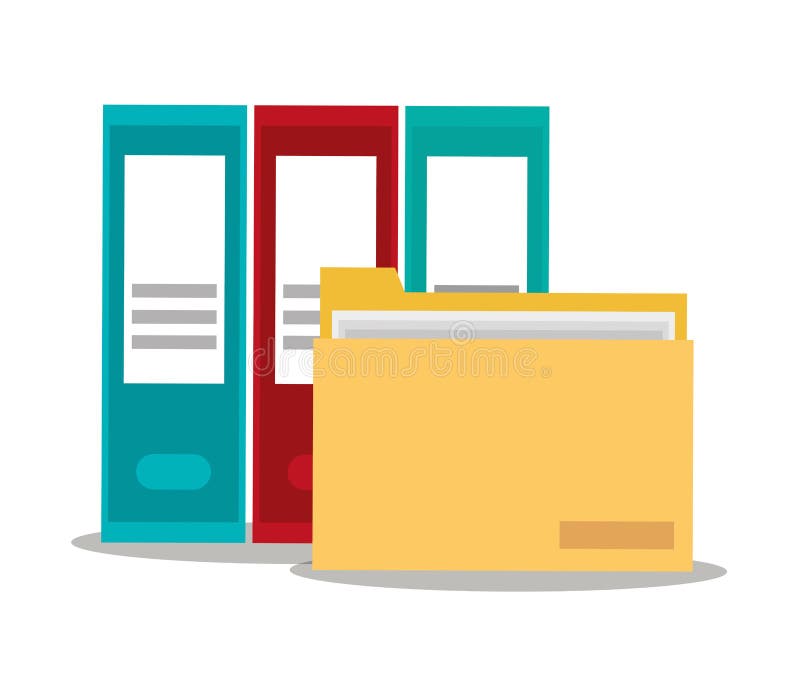
The image size is (800, 697). I want to click on white label on right book, so click(x=468, y=206).